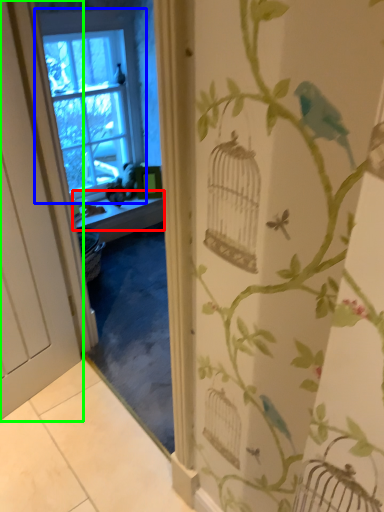
Question: Based on their relative distances, which object is farther from window sill (highlighted by a red box)? Choose from window (highlighted by a blue box) and door (highlighted by a green box).

Choices:
 (A) window
 (B) door

Answer: (B)